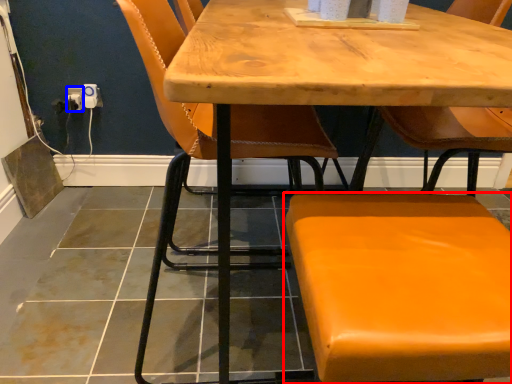
Question: Which of the following is the closest to the observer, chair (highlighted by a red box) or electric outlet (highlighted by a blue box)?

Choices:
 (A) chair
 (B) electric outlet

Answer: (A)